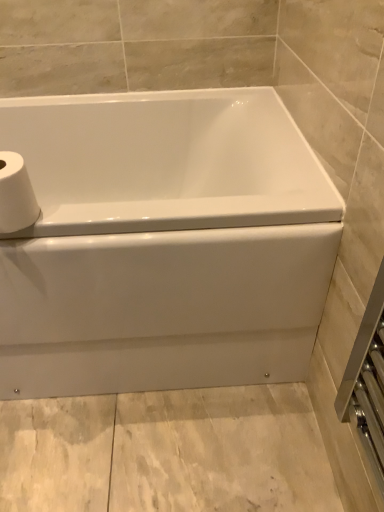
Question: Can you see white matte toilet paper at upper left touching white glossy bathtub at center?

Choices:
 (A) yes
 (B) no

Answer: (B)

Question: Is white matte toilet paper at upper left outside of white glossy bathtub at center?

Choices:
 (A) yes
 (B) no

Answer: (A)

Question: Does white matte toilet paper at upper left have a lesser width compared to white glossy bathtub at center?

Choices:
 (A) yes
 (B) no

Answer: (A)

Question: Considering the relative sizes of white matte toilet paper at upper left and white glossy bathtub at center in the image provided, is white matte toilet paper at upper left shorter than white glossy bathtub at center?

Choices:
 (A) yes
 (B) no

Answer: (A)

Question: Does white matte toilet paper at upper left have a greater width compared to white glossy bathtub at center?

Choices:
 (A) yes
 (B) no

Answer: (B)

Question: Is white matte toilet paper at upper left not near white glossy bathtub at center?

Choices:
 (A) yes
 (B) no

Answer: (B)

Question: Is white glossy bathtub at center surrounding white matte toilet paper at upper left?

Choices:
 (A) yes
 (B) no

Answer: (B)

Question: Is the surface of white glossy bathtub at center in direct contact with white matte toilet paper at upper left?

Choices:
 (A) no
 (B) yes

Answer: (A)

Question: Considering the relative sizes of white glossy bathtub at center and white matte toilet paper at upper left in the image provided, is white glossy bathtub at center taller than white matte toilet paper at upper left?

Choices:
 (A) no
 (B) yes

Answer: (B)

Question: Is white glossy bathtub at center not close to white matte toilet paper at upper left?

Choices:
 (A) yes
 (B) no

Answer: (B)

Question: From the image's perspective, is white glossy bathtub at center below white matte toilet paper at upper left?

Choices:
 (A) no
 (B) yes

Answer: (B)

Question: Does white glossy bathtub at center appear on the right side of white matte toilet paper at upper left?

Choices:
 (A) no
 (B) yes

Answer: (B)

Question: Considering their positions, is white matte toilet paper at upper left located in front of or behind white glossy bathtub at center?

Choices:
 (A) front
 (B) behind

Answer: (A)